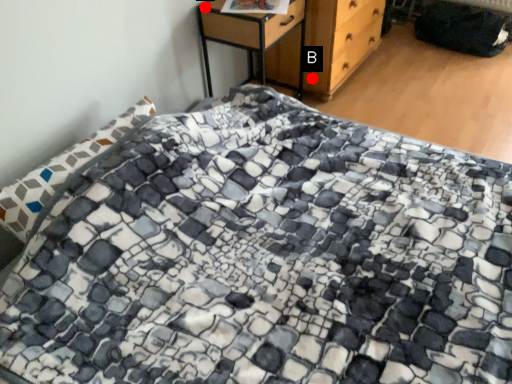
Question: Two points are circled on the image, labeled by A and B beside each circle. Which point is farther to the camera?

Choices:
 (A) A is further
 (B) B is further

Answer: (B)